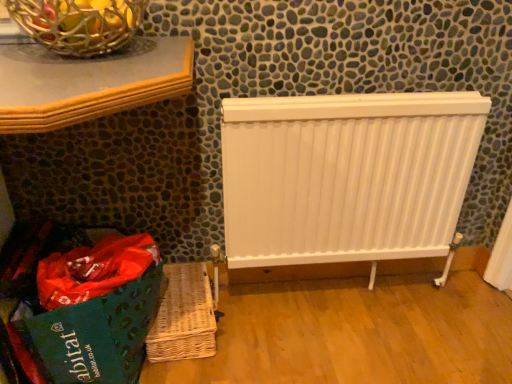
Identify the location of spots to the right of woven brown basket at lower left. (254, 323).